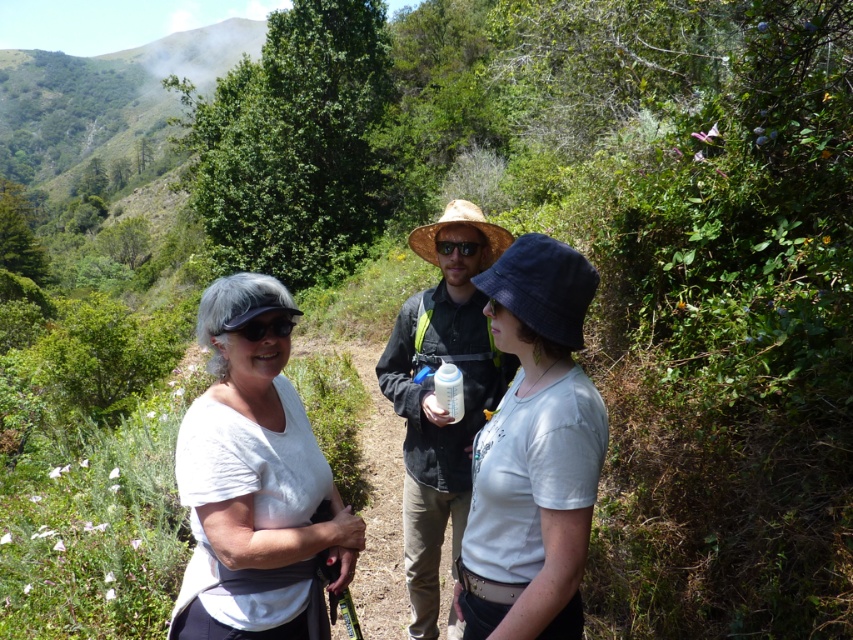
Can you confirm if matte black goggles at center is positioned to the right of gold reflective sunglasses at center?

Incorrect, matte black goggles at center is not on the right side of gold reflective sunglasses at center.

Which of these two, matte black goggles at center or gold reflective sunglasses at center, stands shorter?

Standing shorter between the two is gold reflective sunglasses at center.

Who is more forward, (235, 321) or (434, 246)?

Point (235, 321) is in front.

The image size is (853, 640). I want to click on matte black goggles at center, so click(x=260, y=323).

Between point (524, 509) and point (424, 449), which one is positioned in front?

Point (524, 509) is in front.

Is point (518, 380) less distant than point (431, 580)?

Yes, it is.

Based on the photo, who is more forward, (587, 497) or (437, 259)?

Point (587, 497)

Locate an element on the screen. This screenshot has width=853, height=640. denim hat at center is located at coordinates (532, 451).

Is matte straw hat at center shorter than matte black goggles at center?

Incorrect, matte straw hat at center's height does not fall short of matte black goggles at center's.

Does point (456, 300) come farther from viewer compared to point (271, 317)?

Yes, point (456, 300) is farther from viewer.

What do you see at coordinates (434, 397) in the screenshot? I see `matte straw hat at center` at bounding box center [434, 397].

The image size is (853, 640). Identify the location of matte straw hat at center. tap(434, 397).